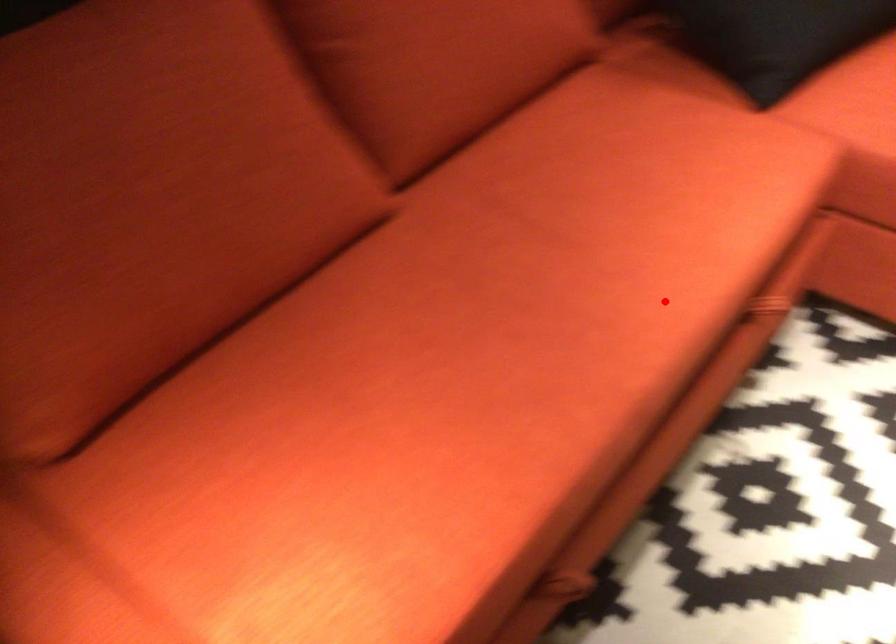
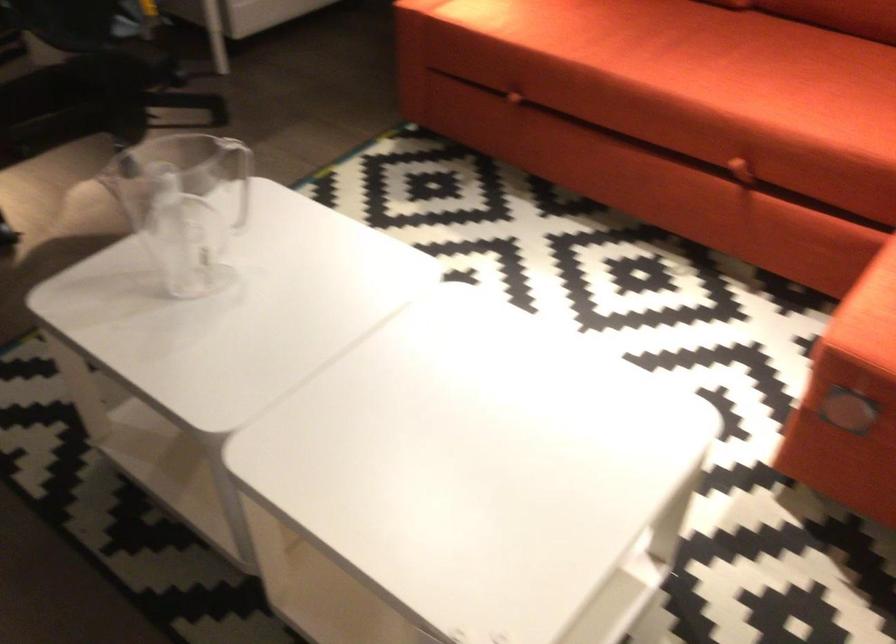
Question: A red point is marked in image1. In image2, is the corresponding 3D point closer to the camera or farther? Reply with the corresponding letter.

Choices:
 (A) The corresponding 3D point is closer.
 (B) The corresponding 3D point is farther.

Answer: (B)